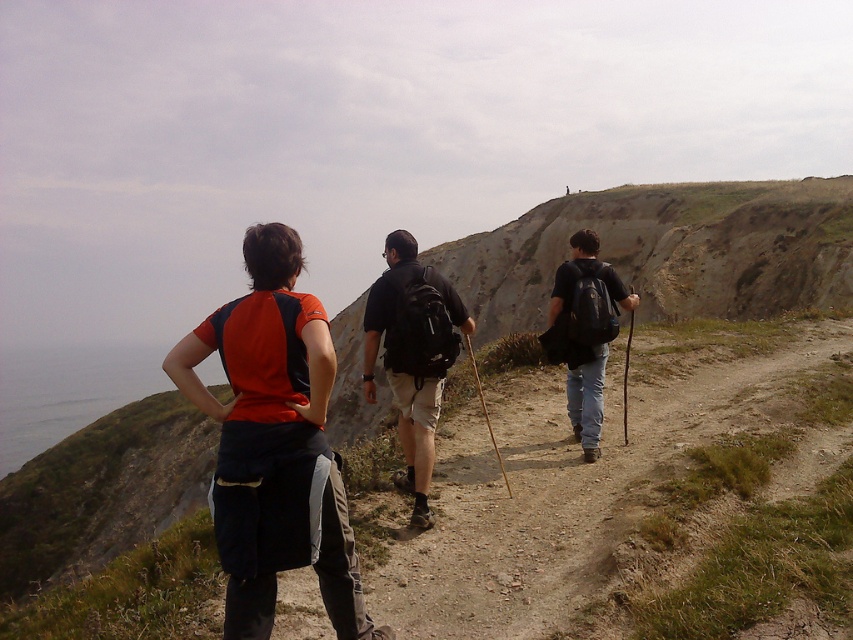
Question: In this image, where is matte orange shirt at center located relative to matte black backpack at center?

Choices:
 (A) right
 (B) left

Answer: (B)

Question: Which of the following is the farthest from the observer?

Choices:
 (A) matte black backpack at center
 (B) matte orange shirt at center

Answer: (A)

Question: Which object appears farthest from the camera in this image?

Choices:
 (A) matte orange shirt at center
 (B) matte black backpack at center

Answer: (B)

Question: Which of the following is the farthest from the observer?

Choices:
 (A) pos(405,449)
 (B) pos(344,564)

Answer: (A)

Question: Can you confirm if matte orange shirt at center is positioned to the right of matte black backpack at center?

Choices:
 (A) no
 (B) yes

Answer: (A)

Question: Is matte orange shirt at center wider than matte black backpack at center?

Choices:
 (A) yes
 (B) no

Answer: (A)